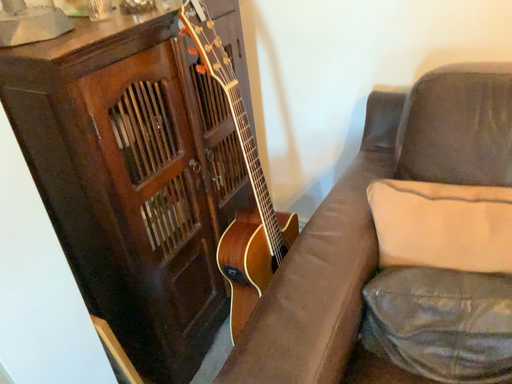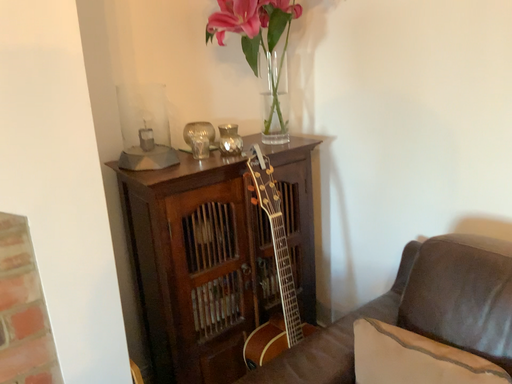
Question: Which way did the camera rotate in the video?

Choices:
 (A) rotated downward
 (B) rotated upward

Answer: (B)